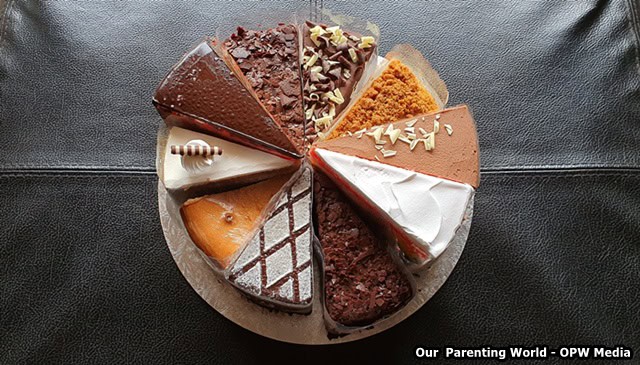
Where is `stack of plates not in image`? stack of plates not in image is located at coordinates (553, 196), (547, 175), (547, 147), (550, 112), (547, 125), (545, 160), (548, 186), (553, 209).